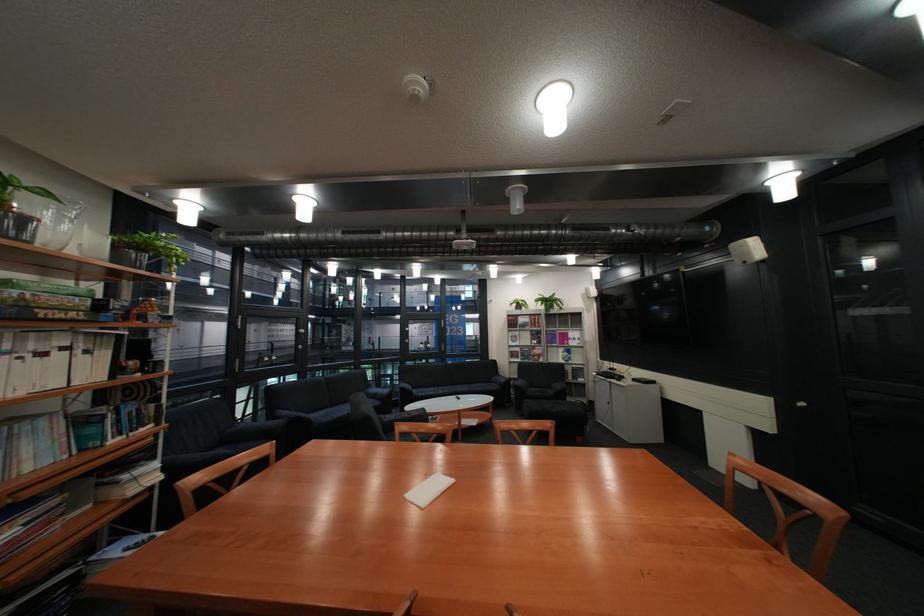
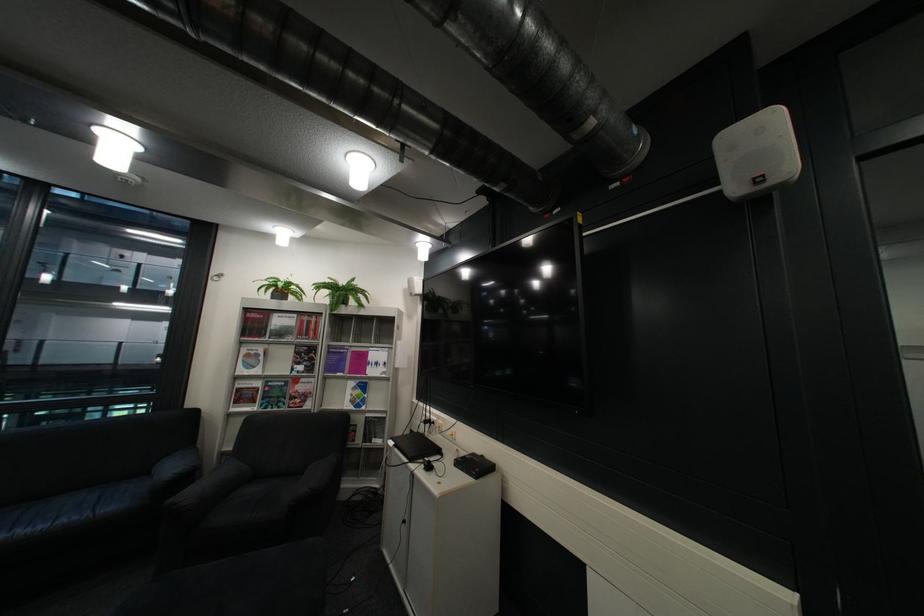
In the second image, find the point that corresponds to (541,354) in the first image.

(290, 394)